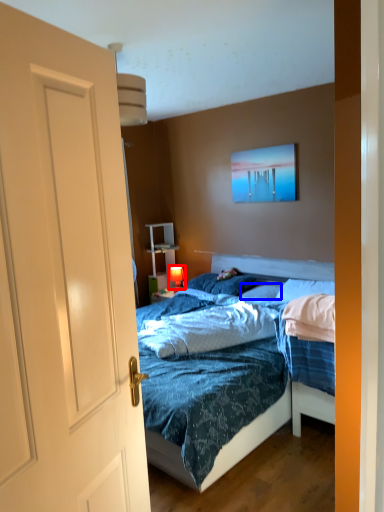
Question: Which object appears closest to the camera in this image, lamp (highlighted by a red box) or pillow (highlighted by a blue box)?

Choices:
 (A) lamp
 (B) pillow

Answer: (B)